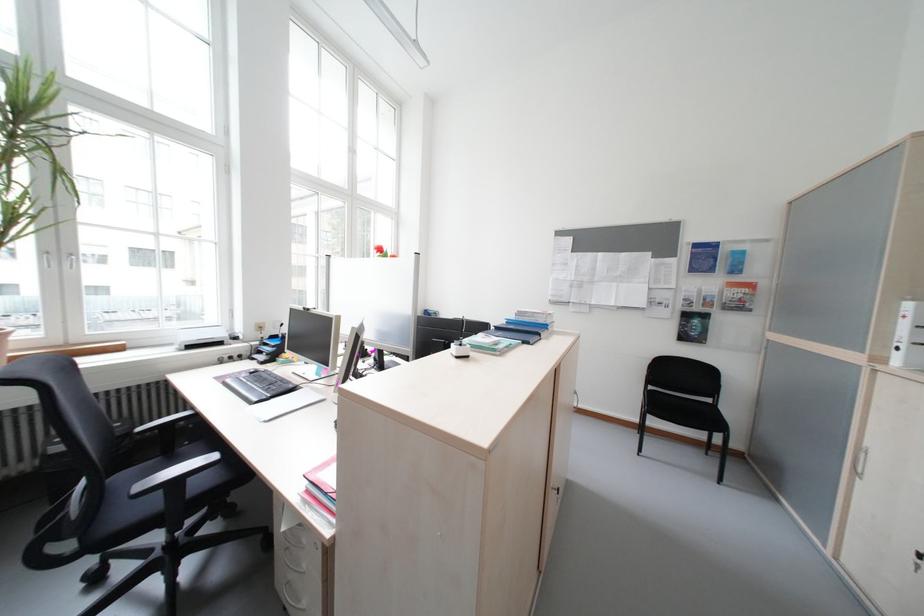
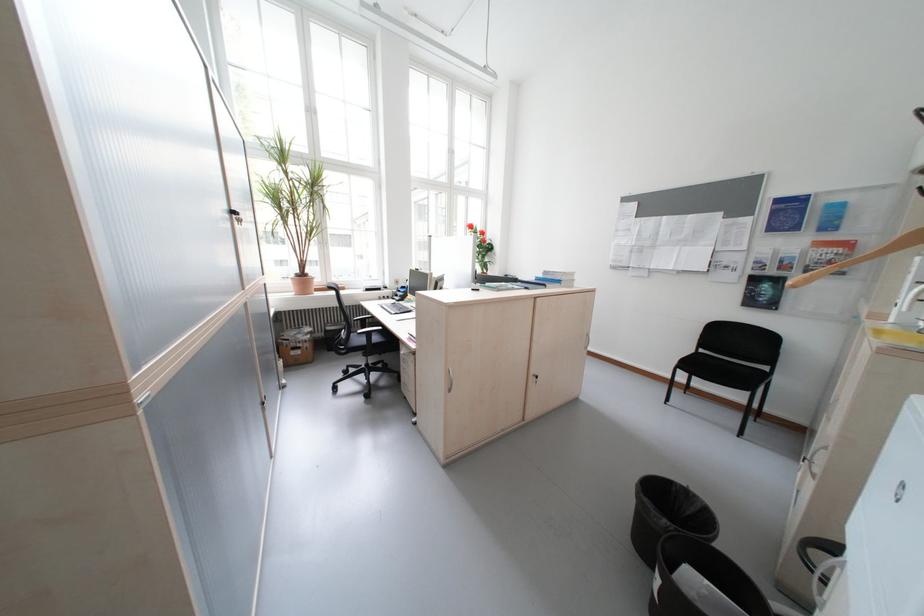
Find the pixel in the second image that matches [719,419] in the first image.

(758, 382)